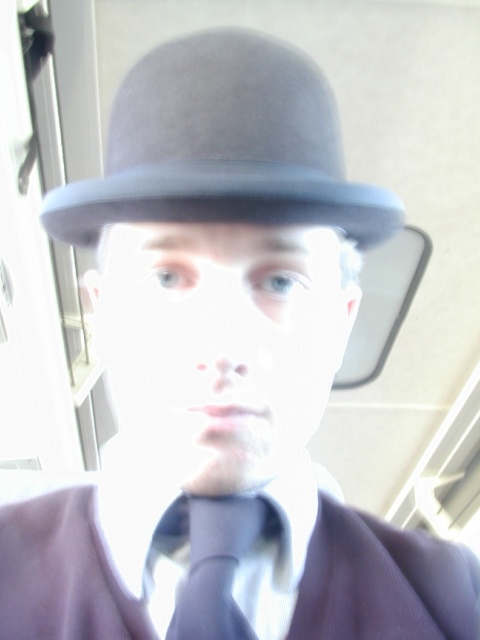
Question: Which object appears closest to the camera in this image?

Choices:
 (A) matte gray fedora at upper center
 (B) matte blue tie at center
 (C) matte purple suit at center

Answer: (A)

Question: Can you confirm if matte gray fedora at upper center is positioned to the right of matte blue tie at center?

Choices:
 (A) yes
 (B) no

Answer: (B)

Question: Which point is closer to the camera?

Choices:
 (A) matte blue tie at center
 (B) matte purple suit at center

Answer: (A)

Question: Is matte gray fedora at upper center to the left of matte blue tie at center from the viewer's perspective?

Choices:
 (A) no
 (B) yes

Answer: (B)

Question: Can you confirm if matte gray fedora at upper center is positioned to the right of matte purple suit at center?

Choices:
 (A) no
 (B) yes

Answer: (A)

Question: Which point appears farthest from the camera in this image?

Choices:
 (A) (193, 564)
 (B) (171, 74)

Answer: (A)